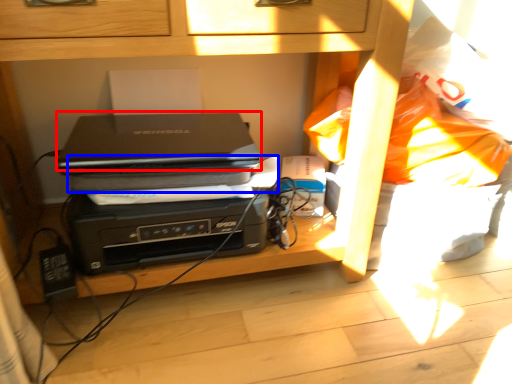
Question: Which point is further to the camera, laptop (highlighted by a red box) or paperback book (highlighted by a blue box)?

Choices:
 (A) laptop
 (B) paperback book

Answer: (B)